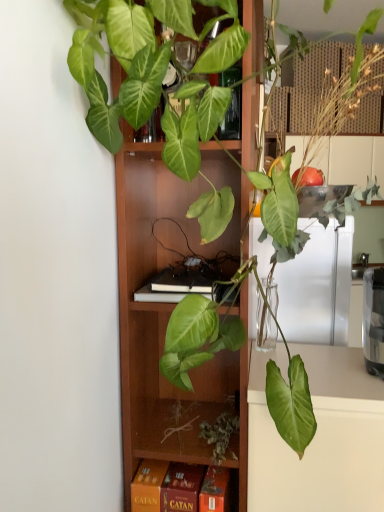
Question: From the image's perspective, is orange matte board game at lower center above or below wooden cabinet at center?

Choices:
 (A) above
 (B) below

Answer: (B)

Question: Looking at the image, does orange matte board game at lower center seem bigger or smaller compared to wooden cabinet at center?

Choices:
 (A) big
 (B) small

Answer: (B)

Question: Is orange matte board game at lower center inside or outside of wooden cabinet at center?

Choices:
 (A) outside
 (B) inside

Answer: (B)

Question: From a real-world perspective, relative to orange matte board game at lower center, is wooden cabinet at center vertically above or below?

Choices:
 (A) above
 (B) below

Answer: (A)

Question: Is wooden cabinet at center wider or thinner than orange matte board game at lower center?

Choices:
 (A) wide
 (B) thin

Answer: (A)

Question: Is wooden cabinet at center taller or shorter than orange matte board game at lower center?

Choices:
 (A) tall
 (B) short

Answer: (A)

Question: Considering their positions, is wooden cabinet at center located in front of or behind orange matte board game at lower center?

Choices:
 (A) front
 (B) behind

Answer: (A)